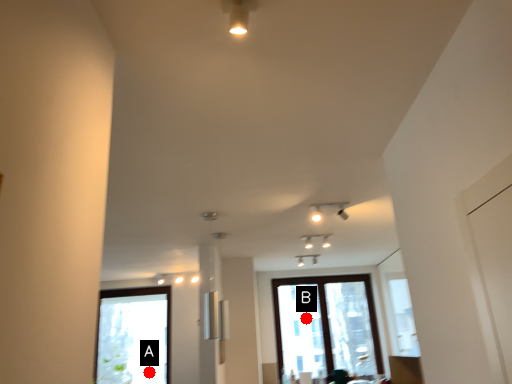
Question: Two points are circled on the image, labeled by A and B beside each circle. Which point appears farthest from the camera in this image?

Choices:
 (A) A is further
 (B) B is further

Answer: (B)